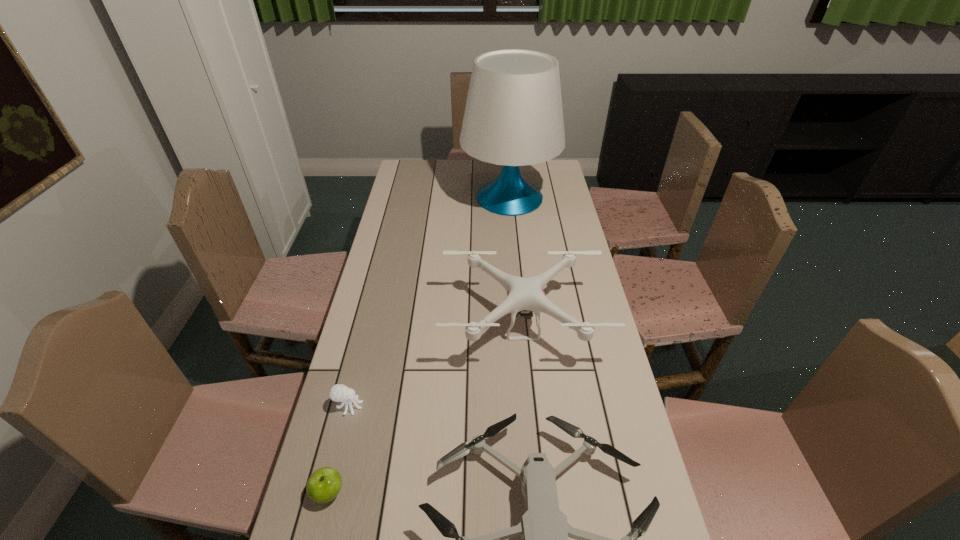
Image resolution: width=960 pixels, height=540 pixels. I want to click on vacant area that satisfies the following two spatial constraints: 1. on the top of the fourth shortest object; 2. on the front-facing side of the third farthest object, so click(x=530, y=406).

The width and height of the screenshot is (960, 540). Identify the location of vacant point that satisfies the following two spatial constraints: 1. on the front-facing side of the apple; 2. on the left side of the third nearest object. (327, 492).

Identify the location of vacant area that satisfies the following two spatial constraints: 1. on the front-facing side of the apple; 2. on the left side of the third nearest object. The height and width of the screenshot is (540, 960). (327, 492).

Where is `free point that satisfies the following two spatial constraints: 1. on the front-facing side of the third nearest object; 2. on the left side of the apple`? The image size is (960, 540). free point that satisfies the following two spatial constraints: 1. on the front-facing side of the third nearest object; 2. on the left side of the apple is located at coordinates (327, 492).

The width and height of the screenshot is (960, 540). What are the coordinates of `vacant point that satisfies the following two spatial constraints: 1. on the top of the second farthest object; 2. on the front-facing side of the octopus` in the screenshot? It's located at (530, 406).

Locate an element on the screen. The image size is (960, 540). blank area in the image that satisfies the following two spatial constraints: 1. on the front-facing side of the farthest object; 2. on the front side of the apple is located at coordinates (537, 492).